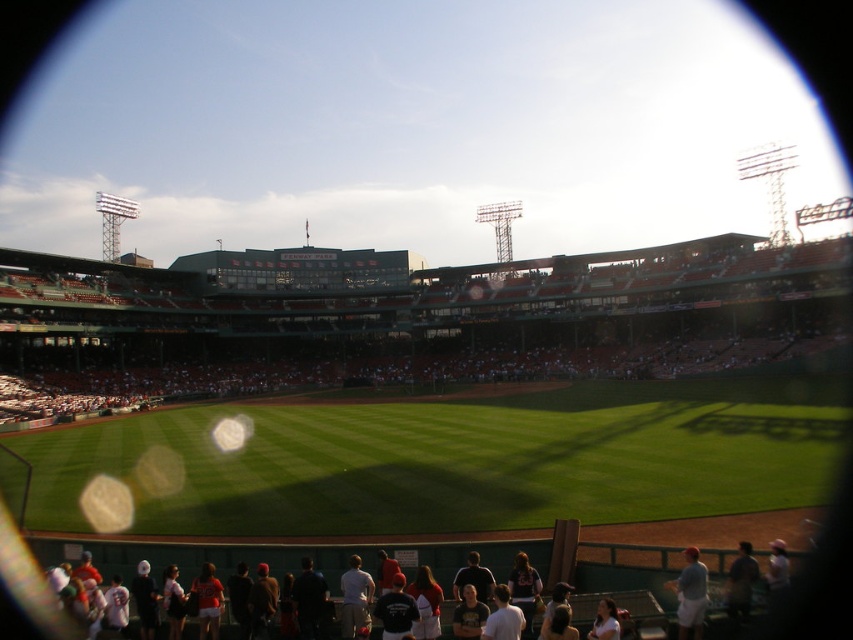
Between light blue fabric shirt at lower right and white cotton shirt at lower right, which one has less height?

white cotton shirt at lower right

Is light blue fabric shirt at lower right above white cotton shirt at lower right?

Yes.

This screenshot has width=853, height=640. I want to click on light blue fabric shirt at lower right, so pyautogui.click(x=689, y=595).

Does white cotton shirt at center have a greater width compared to dark blue shirt at lower right?

No, white cotton shirt at center is not wider than dark blue shirt at lower right.

Looking at this image, does white cotton shirt at center have a larger size compared to dark blue shirt at lower right?

Indeed, white cotton shirt at center has a larger size compared to dark blue shirt at lower right.

This screenshot has height=640, width=853. Find the location of `white cotton shirt at center`. white cotton shirt at center is located at coordinates (354, 596).

Does white cotton shirt at center lie in front of white cotton shirt at lower right?

No, it is behind white cotton shirt at lower right.

Is point (352, 566) positioned after point (616, 612)?

Yes, point (352, 566) is behind point (616, 612).

Where is `white cotton shirt at center`? The width and height of the screenshot is (853, 640). white cotton shirt at center is located at coordinates (354, 596).